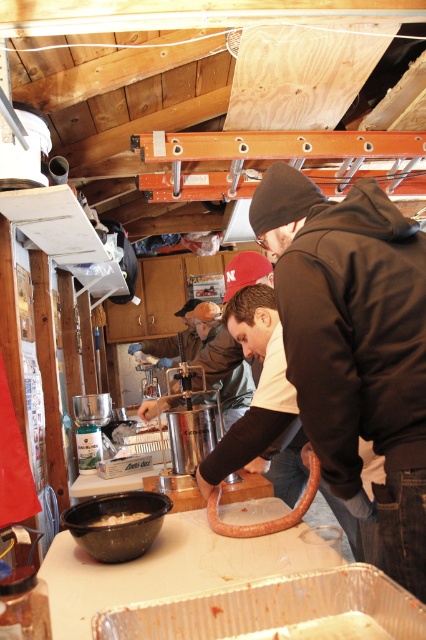
Where is `black matte jacket at center`? This screenshot has width=426, height=640. black matte jacket at center is located at coordinates (354, 346).

Can you confirm if black matte jacket at center is positioned above white matte bowl at lower left?

Correct, black matte jacket at center is located above white matte bowl at lower left.

Who is more distant from viewer, (360, 189) or (118, 522)?

The point (118, 522) is behind.

Locate an element on the screen. This screenshot has height=640, width=426. black matte jacket at center is located at coordinates pyautogui.click(x=354, y=346).